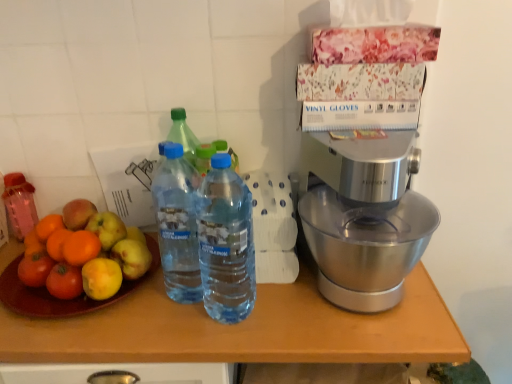
Question: Does blue plastic bottle at center, which is counted as the second bottle, starting from the back, have a greater height compared to wooden table at center?

Choices:
 (A) yes
 (B) no

Answer: (B)

Question: Is blue plastic bottle at center, which is counted as the second bottle, starting from the back, further to the viewer compared to wooden table at center?

Choices:
 (A) yes
 (B) no

Answer: (B)

Question: Does blue plastic bottle at center, which is counted as the second bottle, starting from the back, have a lesser height compared to wooden table at center?

Choices:
 (A) no
 (B) yes

Answer: (B)

Question: Can you confirm if blue plastic bottle at center, placed as the second bottle when sorted from right to left, is bigger than wooden table at center?

Choices:
 (A) no
 (B) yes

Answer: (A)

Question: From the image's perspective, is blue plastic bottle at center, positioned as the second bottle in left-to-right order, beneath wooden table at center?

Choices:
 (A) yes
 (B) no

Answer: (B)

Question: Is blue plastic bottle at center, positioned as the second bottle in left-to-right order, positioned with its back to wooden table at center?

Choices:
 (A) no
 (B) yes

Answer: (A)

Question: Does wooden table at center turn towards transparent plastic bottle at center, placed as the first bottle when sorted from front to back?

Choices:
 (A) no
 (B) yes

Answer: (A)

Question: Is wooden table at center further to the viewer compared to transparent plastic bottle at center, the first bottle positioned from the right?

Choices:
 (A) yes
 (B) no

Answer: (A)

Question: Considering the relative sizes of wooden table at center and transparent plastic bottle at center, the first bottle positioned from the right, in the image provided, is wooden table at center wider than transparent plastic bottle at center, the first bottle positioned from the right,?

Choices:
 (A) yes
 (B) no

Answer: (A)

Question: Is wooden table at center not close to transparent plastic bottle at center, the first bottle positioned from the right?

Choices:
 (A) yes
 (B) no

Answer: (B)

Question: From the image's perspective, is wooden table at center on transparent plastic bottle at center, acting as the 3th bottle starting from the back?

Choices:
 (A) yes
 (B) no

Answer: (B)

Question: From a real-world perspective, does wooden table at center sit lower than transparent plastic bottle at center, which is counted as the 3th bottle, starting from the left?

Choices:
 (A) yes
 (B) no

Answer: (A)

Question: Is blue plastic bottle at center, placed as the second bottle when sorted from right to left, far from pink translucent bottle at left, placed as the 1th bottle when sorted from left to right?

Choices:
 (A) no
 (B) yes

Answer: (A)